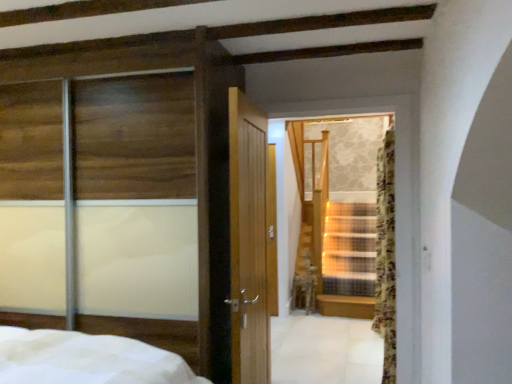
Question: Should I look upward or downward to see transparent glass stairs at center?

Choices:
 (A) up
 (B) down

Answer: (B)

Question: Is transparent glass sliding door at left taller than transparent glass stairs at center?

Choices:
 (A) no
 (B) yes

Answer: (B)

Question: Is transparent glass stairs at center inside transparent glass sliding door at left?

Choices:
 (A) yes
 (B) no

Answer: (B)

Question: Can you confirm if transparent glass sliding door at left is positioned to the left of transparent glass stairs at center?

Choices:
 (A) no
 (B) yes

Answer: (B)

Question: Is transparent glass sliding door at left oriented towards transparent glass stairs at center?

Choices:
 (A) no
 (B) yes

Answer: (A)

Question: Does transparent glass sliding door at left have a lesser width compared to transparent glass stairs at center?

Choices:
 (A) no
 (B) yes

Answer: (A)

Question: Is transparent glass sliding door at left completely or partially outside of transparent glass stairs at center?

Choices:
 (A) no
 (B) yes

Answer: (B)

Question: Is transparent glass sliding door at left located outside floral fabric curtain at right?

Choices:
 (A) yes
 (B) no

Answer: (A)

Question: Is transparent glass sliding door at left in front of floral fabric curtain at right?

Choices:
 (A) yes
 (B) no

Answer: (A)

Question: Are transparent glass sliding door at left and floral fabric curtain at right making contact?

Choices:
 (A) yes
 (B) no

Answer: (B)

Question: From a real-world perspective, does transparent glass sliding door at left stand above floral fabric curtain at right?

Choices:
 (A) yes
 (B) no

Answer: (A)

Question: Considering the relative positions of transparent glass sliding door at left and floral fabric curtain at right in the image provided, is transparent glass sliding door at left behind floral fabric curtain at right?

Choices:
 (A) yes
 (B) no

Answer: (B)

Question: Can you confirm if transparent glass sliding door at left is bigger than floral fabric curtain at right?

Choices:
 (A) yes
 (B) no

Answer: (A)

Question: Is floral fabric curtain at right wider than transparent glass sliding door at left?

Choices:
 (A) yes
 (B) no

Answer: (B)